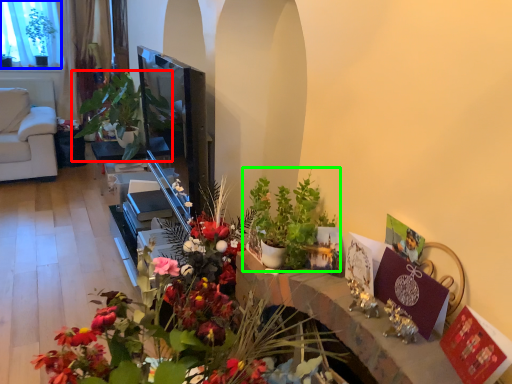
Question: Which object is positioned closest to houseplant (highlighted by a red box)? Select from window screen (highlighted by a blue box) and houseplant (highlighted by a green box).

Choices:
 (A) window screen
 (B) houseplant

Answer: (A)